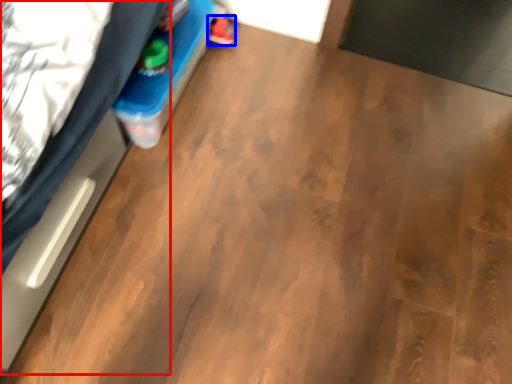
Question: Which of the following is the closest to the observer, bed (highlighted by a red box) or footwear (highlighted by a blue box)?

Choices:
 (A) bed
 (B) footwear

Answer: (A)